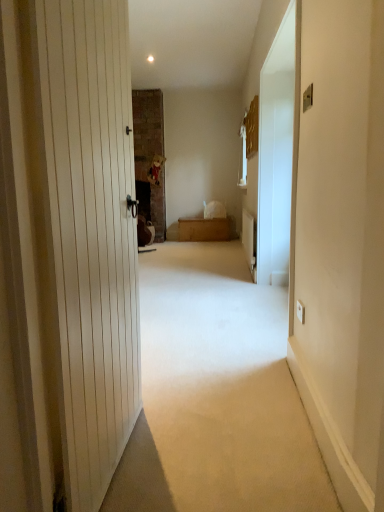
Question: Is wooden chest at center in front of or behind white glossy screen door at right in the image?

Choices:
 (A) front
 (B) behind

Answer: (B)

Question: Choose the correct answer: Is wooden chest at center inside white glossy screen door at right or outside it?

Choices:
 (A) outside
 (B) inside

Answer: (A)

Question: Considering the real-world distances, which object is closest to the beige carpet at center?

Choices:
 (A) white glossy screen door at right
 (B) wooden chest at center

Answer: (A)

Question: Which of these objects is positioned closest to the wooden chest at center?

Choices:
 (A) white glossy screen door at right
 (B) beige carpet at center

Answer: (A)